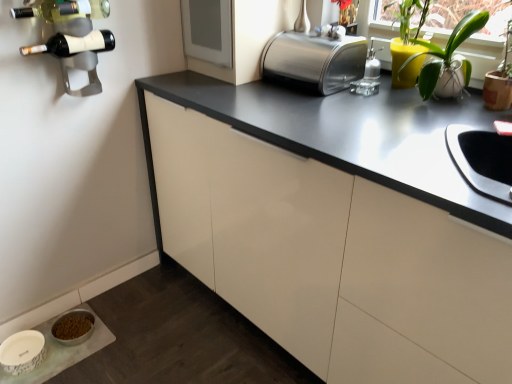
The image size is (512, 384). Identify the location of free space to the right of white glossy pet food bowl at lower left. (134, 340).